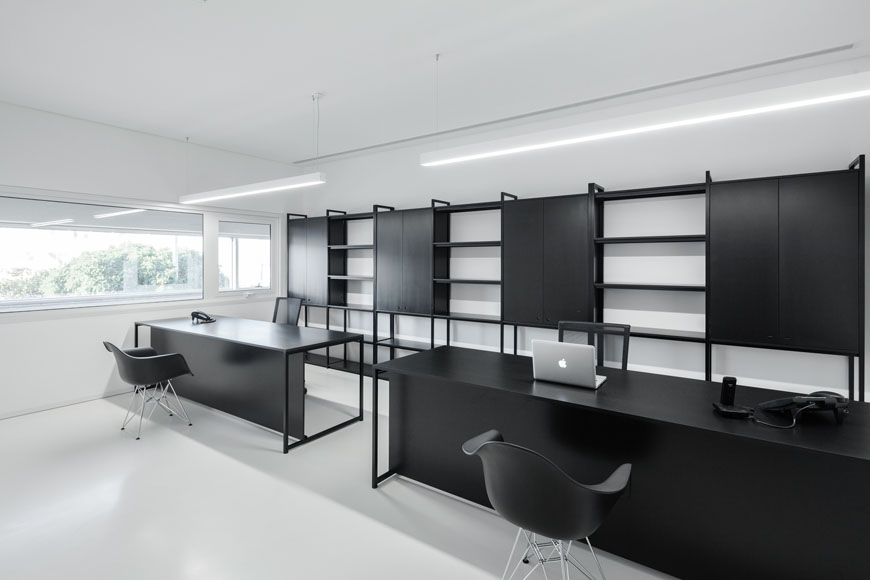
I want to click on glass table, so click(363, 375).